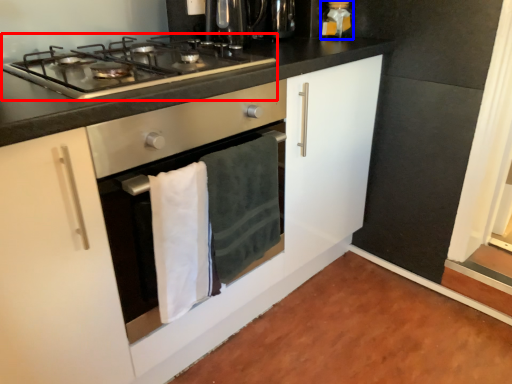
Question: Which point is further to the camera, gas stove (highlighted by a red box) or kitchen appliance (highlighted by a blue box)?

Choices:
 (A) gas stove
 (B) kitchen appliance

Answer: (B)